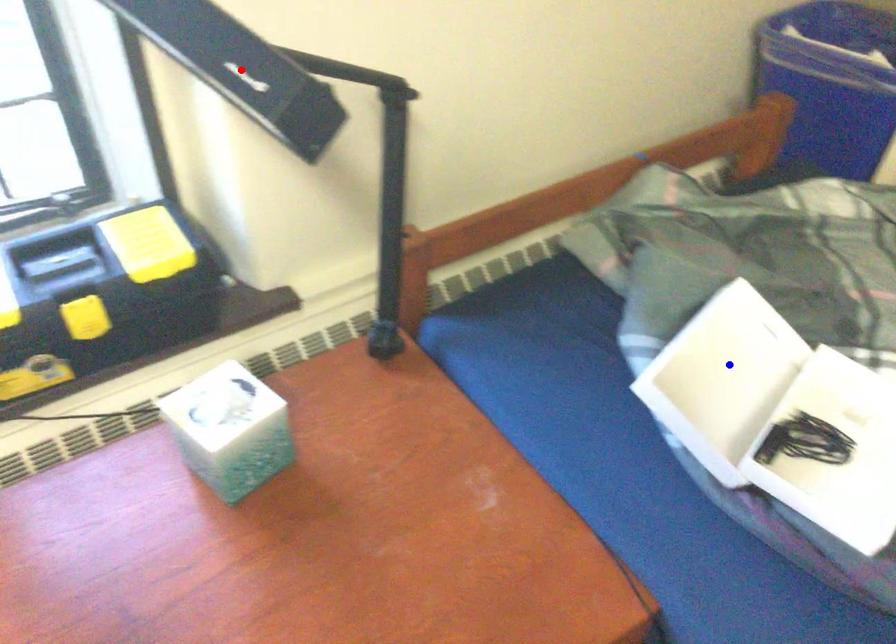
Question: Two points are marked on the image. Which point is closer to the camera?

Choices:
 (A) Blue point is closer.
 (B) Red point is closer.

Answer: (B)